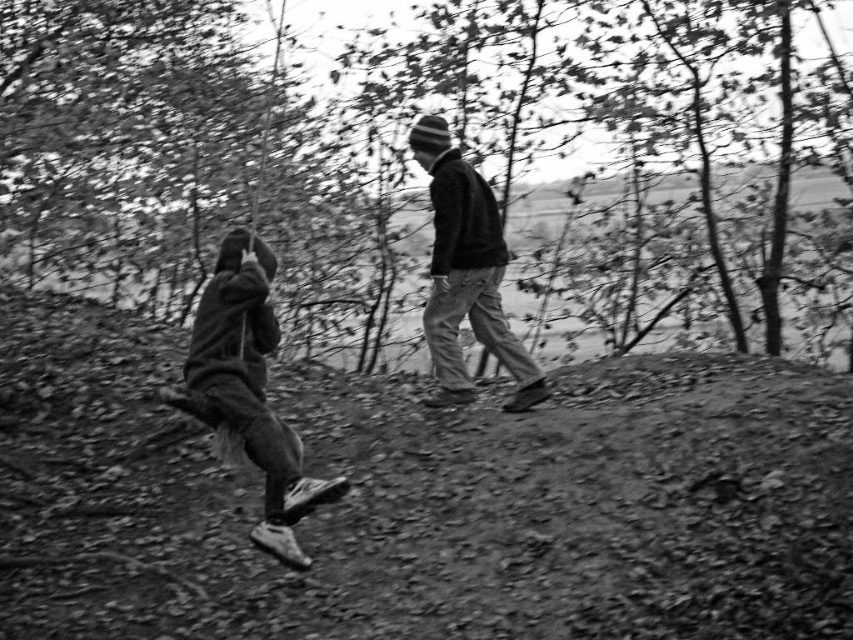
Question: Considering the relative positions of smooth bark tree at upper center and knit cap at center in the image provided, where is smooth bark tree at upper center located with respect to knit cap at center?

Choices:
 (A) above
 (B) below

Answer: (A)

Question: Which object appears closest to the camera in this image?

Choices:
 (A) knit cap at center
 (B) smooth bark tree at upper center

Answer: (A)

Question: Can you confirm if smooth bark tree at upper center is positioned below knit cap at center?

Choices:
 (A) yes
 (B) no

Answer: (B)

Question: Is dark gray fleece jacket at lower left to the right of knit cap at center from the viewer's perspective?

Choices:
 (A) no
 (B) yes

Answer: (A)

Question: Based on their relative distances, which object is nearer to the knit cap at center?

Choices:
 (A) dark gray fleece jacket at lower left
 (B) smooth bark tree at upper center

Answer: (A)

Question: Which point is farther from the camera taking this photo?

Choices:
 (A) (460, 74)
 (B) (282, 433)

Answer: (A)